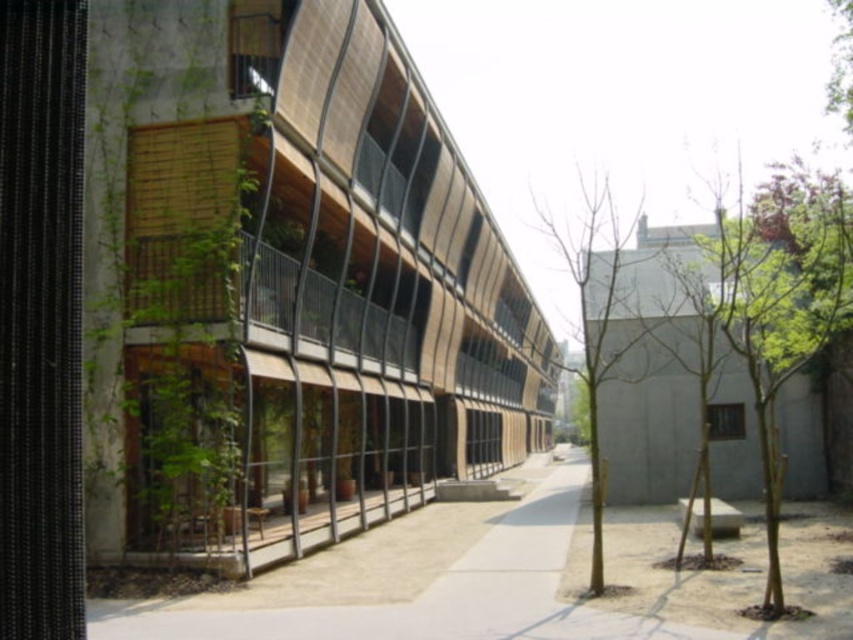
You are a delivery person approaching the entrance of the building and need to park your vehicle on the smooth concrete pavement at center. However, there is a green leafy tree at center in the way. Can you drive your vehicle around the tree to access the pavement?

The smooth concrete pavement at center is to the left of the green leafy tree at center, so you can drive your vehicle around the tree to the left side to access the pavement.